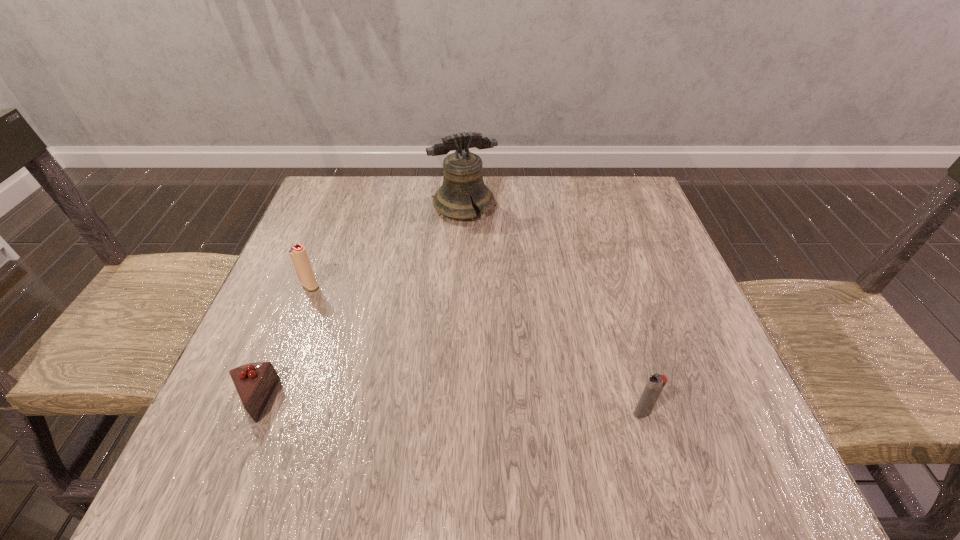
This screenshot has height=540, width=960. Identify the location of the farthest object. (463, 181).

This screenshot has width=960, height=540. In order to click on bell in this screenshot , I will do `click(463, 181)`.

At what (x,y) coordinates should I click in order to perform the action: click on the left igniter. Please return your answer as a coordinate pair (x, y). This screenshot has width=960, height=540. Looking at the image, I should click on (299, 256).

Where is `the second farthest object`? The height and width of the screenshot is (540, 960). the second farthest object is located at coordinates (299, 256).

Locate an element on the screen. the rightmost object is located at coordinates (655, 384).

Identify the location of the nearer igniter. (655, 384).

The width and height of the screenshot is (960, 540). In order to click on the shortest object in this screenshot , I will do `click(255, 382)`.

Where is `blank area located on the left of the third object from left to right`? This screenshot has height=540, width=960. blank area located on the left of the third object from left to right is located at coordinates (335, 206).

Where is `vacant region located 0.260m on the back of the third nearest object`? This screenshot has height=540, width=960. vacant region located 0.260m on the back of the third nearest object is located at coordinates (339, 212).

Where is `vacant space situated on the back of the rightmost object`? The width and height of the screenshot is (960, 540). vacant space situated on the back of the rightmost object is located at coordinates (597, 258).